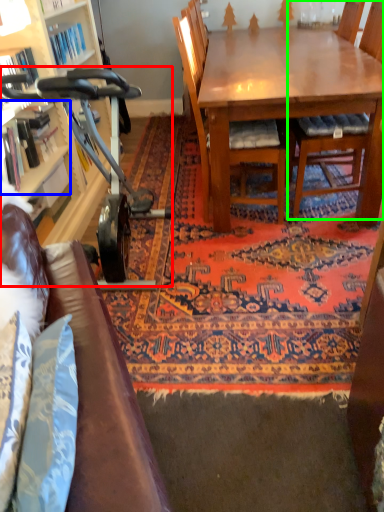
Question: Which is farther away from baby carriage (highlighted by a red box)? shelf (highlighted by a blue box) or chair (highlighted by a green box)?

Choices:
 (A) shelf
 (B) chair

Answer: (B)